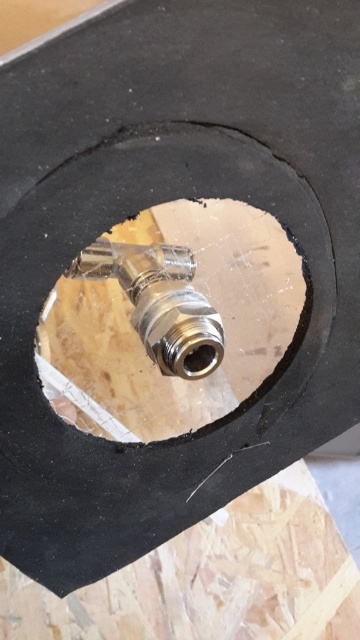
Question: Which of the following is the farthest from the observer?

Choices:
 (A) (180, 349)
 (B) (169, 208)

Answer: (B)

Question: Does metallic brass valve at center have a smaller size compared to polished brass valve at center?

Choices:
 (A) yes
 (B) no

Answer: (B)

Question: Observing the image, what is the correct spatial positioning of metallic brass valve at center in reference to polished brass valve at center?

Choices:
 (A) left
 (B) right

Answer: (B)

Question: Among these objects, which one is nearest to the camera?

Choices:
 (A) metallic brass valve at center
 (B) polished brass valve at center

Answer: (A)

Question: Does metallic brass valve at center have a smaller size compared to polished brass valve at center?

Choices:
 (A) yes
 (B) no

Answer: (B)